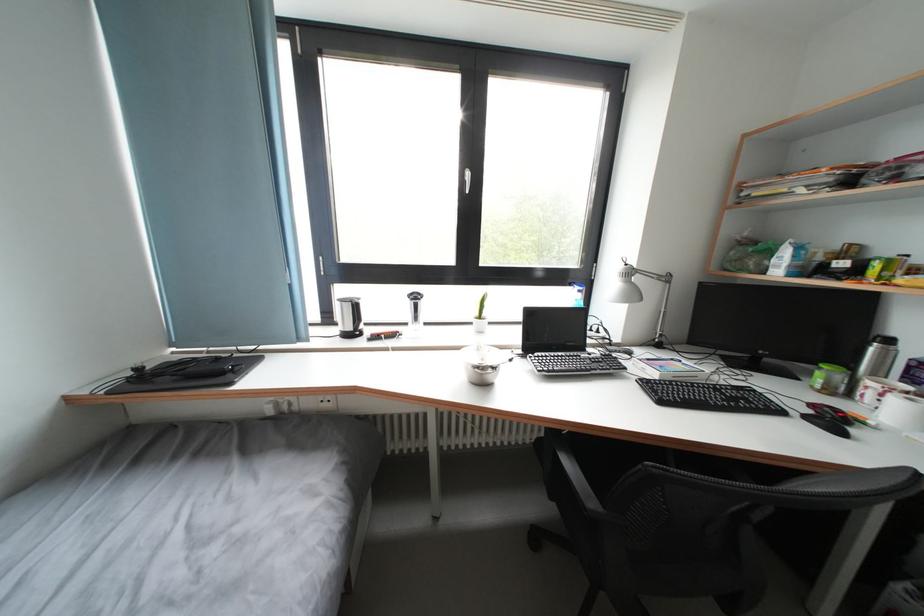
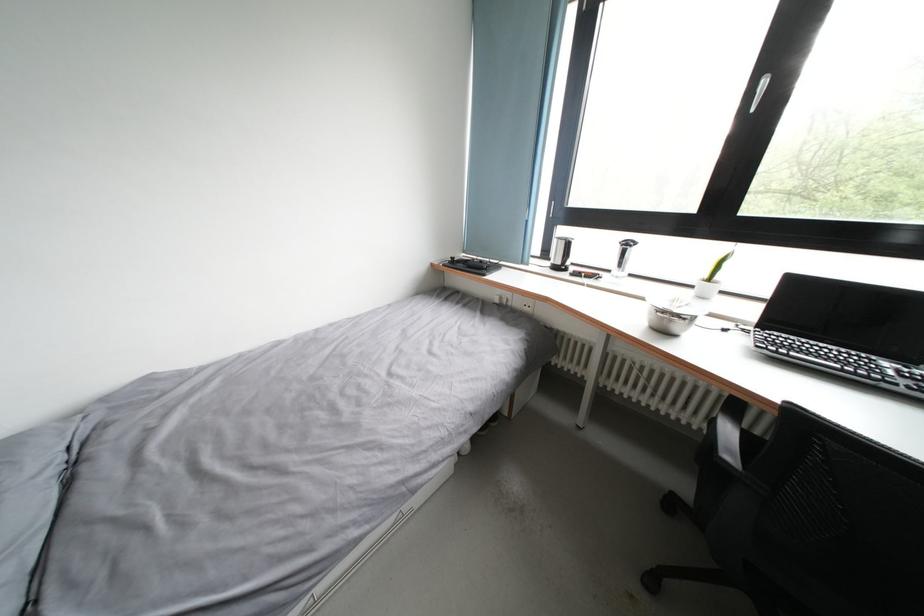
Locate, in the second image, the point that corresponds to point 485,371 in the first image.

(670, 317)